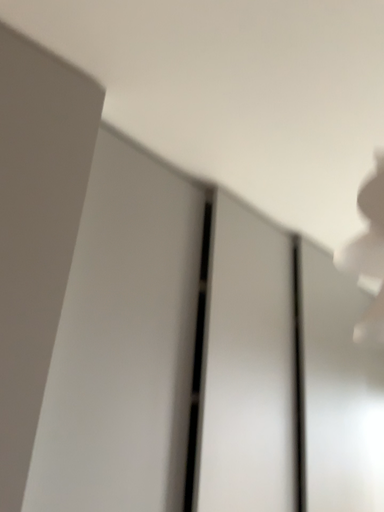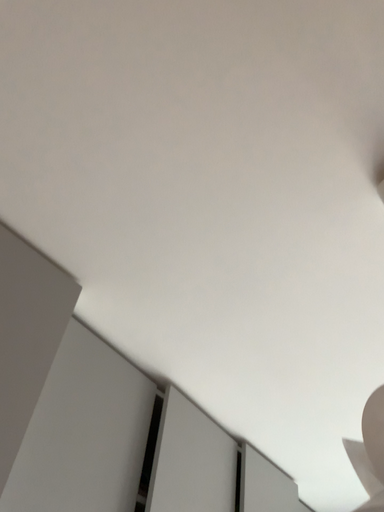
Question: Which way did the camera rotate in the video?

Choices:
 (A) rotated upward
 (B) rotated downward

Answer: (A)